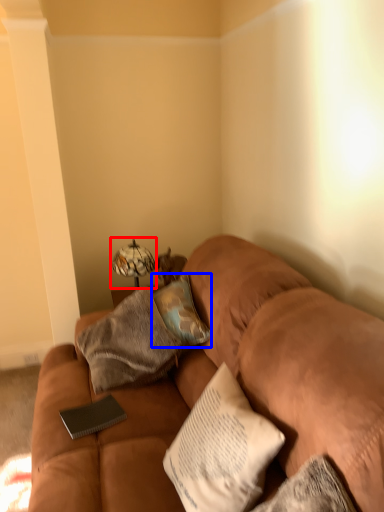
Question: Which of the following is the farthest to the observer, table lamp (highlighted by a red box) or pillow (highlighted by a blue box)?

Choices:
 (A) table lamp
 (B) pillow

Answer: (A)